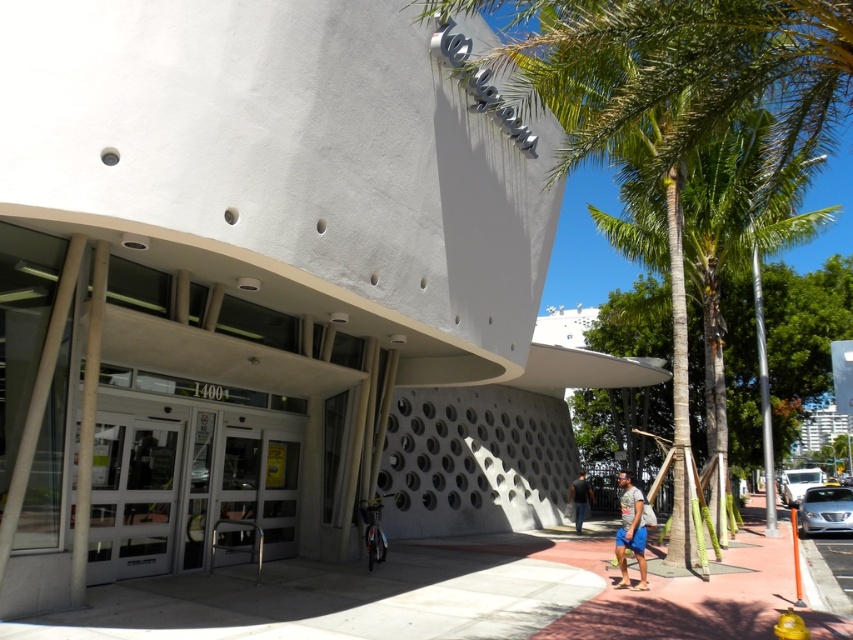
Question: Which is nearer to the concrete sidewalk at center?

Choices:
 (A) matte blue shorts at lower right
 (B) green textured palm tree at right
 (C) white glossy car at right

Answer: (A)

Question: Which point appears farthest from the camera in this image?

Choices:
 (A) (584, 508)
 (B) (161, 420)
 (C) (463, 634)
 (D) (840, 497)

Answer: (A)

Question: Which object is closer to the camera taking this photo?

Choices:
 (A) dark gray shirt at center
 (B) green textured palm tree at right

Answer: (B)

Question: From the image, what is the correct spatial relationship of matte blue shorts at lower right in relation to white glossy car at right?

Choices:
 (A) left
 (B) right

Answer: (A)

Question: Is concrete sidewalk at center further to camera compared to matte blue shorts at lower right?

Choices:
 (A) yes
 (B) no

Answer: (B)

Question: Is the position of green textured palm tree at right more distant than that of dark gray shirt at center?

Choices:
 (A) yes
 (B) no

Answer: (B)